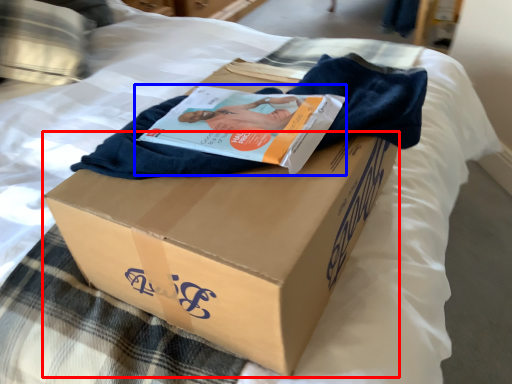
Question: Among these objects, which one is nearest to the camera, cardboard box (highlighted by a red box) or magazine (highlighted by a blue box)?

Choices:
 (A) cardboard box
 (B) magazine

Answer: (A)